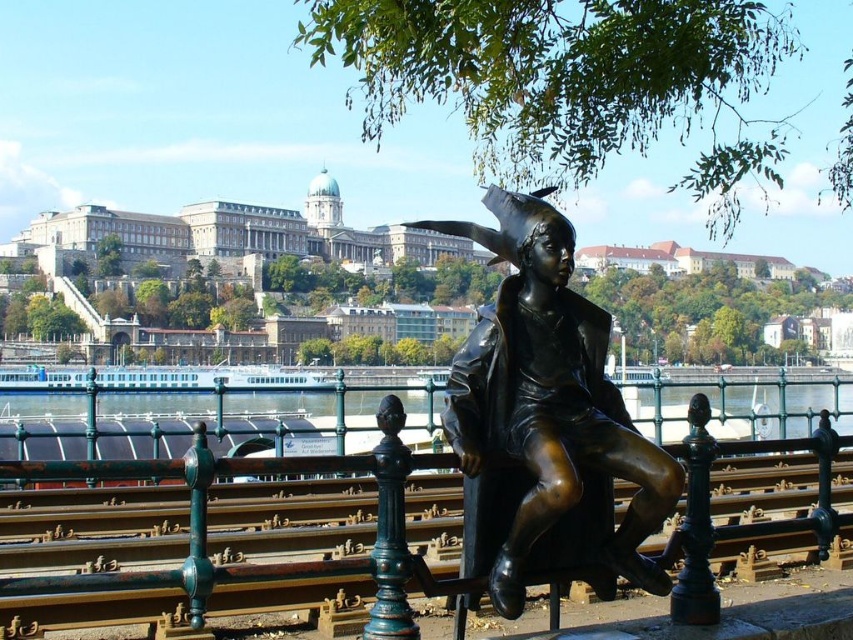
Question: Can you confirm if bronze at center is positioned above bronze statue at center?

Choices:
 (A) no
 (B) yes

Answer: (A)

Question: Can you confirm if bronze at center is positioned below bronze statue at center?

Choices:
 (A) no
 (B) yes

Answer: (B)

Question: Considering the relative positions of bronze at center and bronze statue at center in the image provided, where is bronze at center located with respect to bronze statue at center?

Choices:
 (A) below
 (B) above

Answer: (A)

Question: Among these points, which one is farthest from the camera?

Choices:
 (A) (189, 593)
 (B) (492, 500)

Answer: (B)

Question: Which point is closer to the camera taking this photo?

Choices:
 (A) (402, 634)
 (B) (538, 497)

Answer: (A)